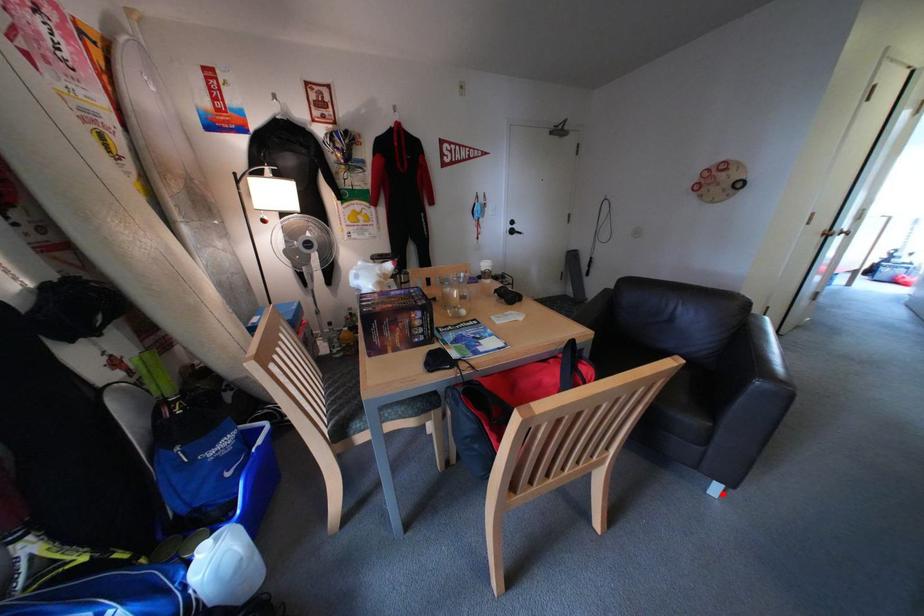
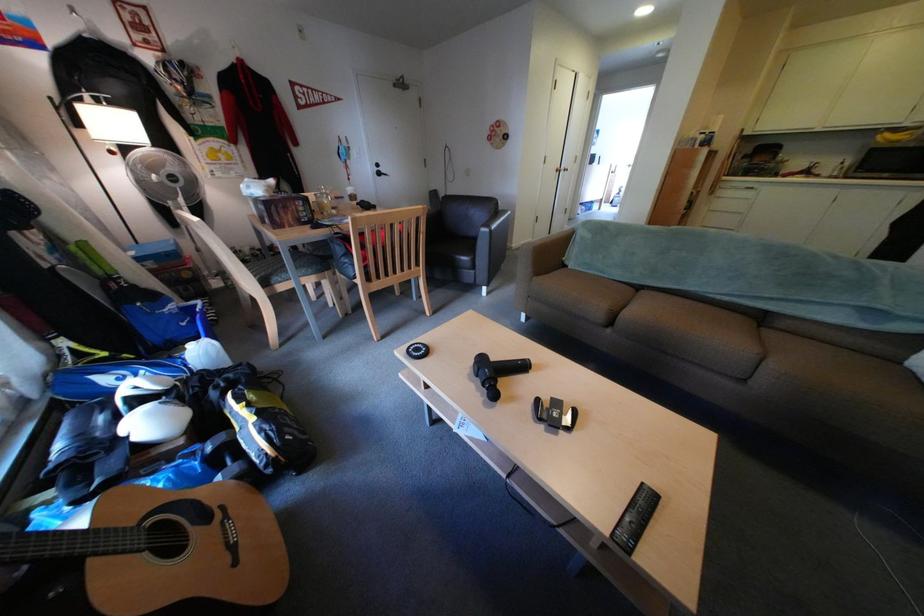
Where in the second image is the point corresponding to the highlighted location from the first image?

(496, 296)